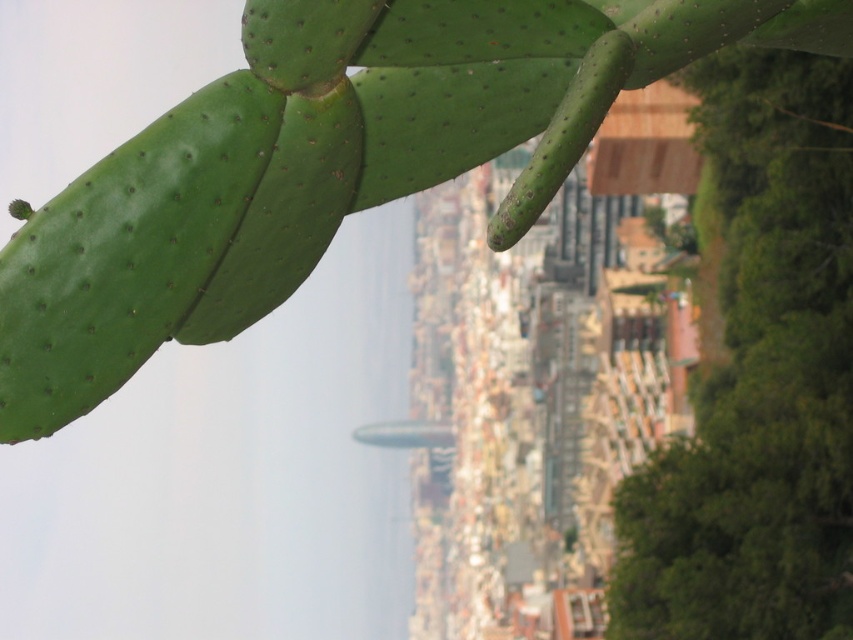
Question: Can you confirm if green spiny cactus at upper left is positioned to the right of green leafy tree at right?

Choices:
 (A) no
 (B) yes

Answer: (A)

Question: Is green spiny cactus at upper left smaller than green leafy tree at right?

Choices:
 (A) no
 (B) yes

Answer: (B)

Question: Among these objects, which one is farthest from the camera?

Choices:
 (A) green spiny cactus at upper left
 (B) green leafy tree at right

Answer: (B)

Question: Can you confirm if green spiny cactus at upper left is positioned to the left of green leafy tree at right?

Choices:
 (A) yes
 (B) no

Answer: (A)